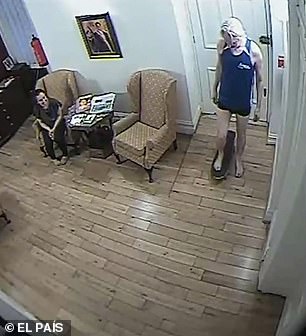
Locate an element on the screen. The height and width of the screenshot is (336, 306). door lock is located at coordinates (263, 40).